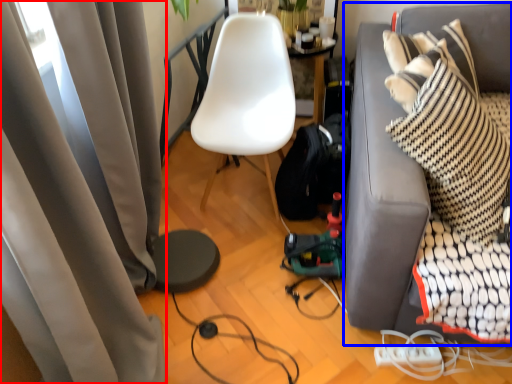
Question: Which point is further to the camera, curtain (highlighted by a red box) or studio couch (highlighted by a blue box)?

Choices:
 (A) curtain
 (B) studio couch

Answer: (B)